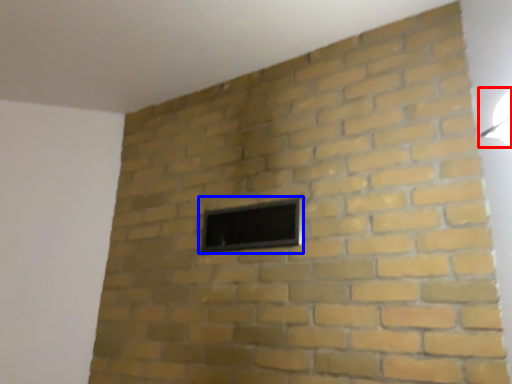
Question: Which object appears farthest to the camera in this image, light fixture (highlighted by a red box) or window (highlighted by a blue box)?

Choices:
 (A) light fixture
 (B) window

Answer: (B)